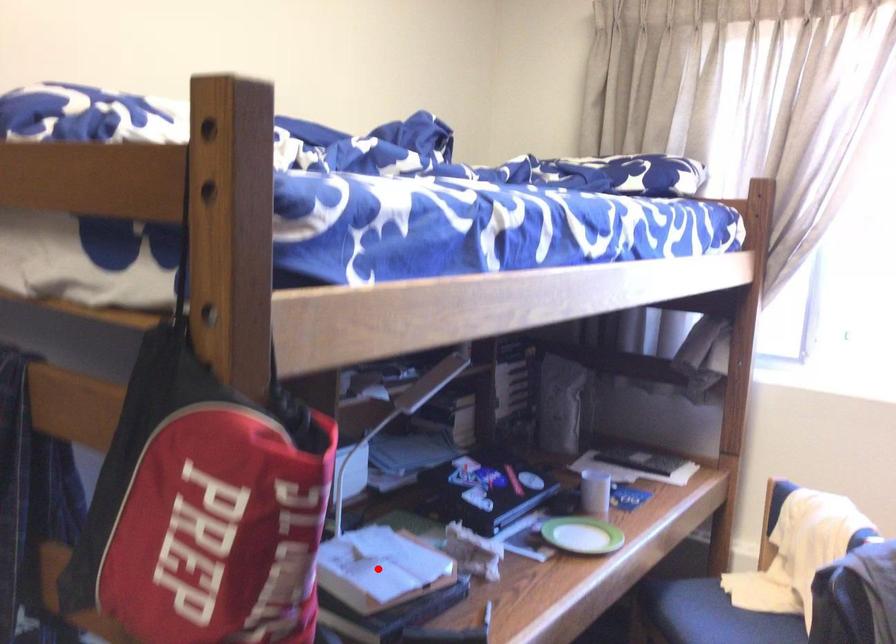
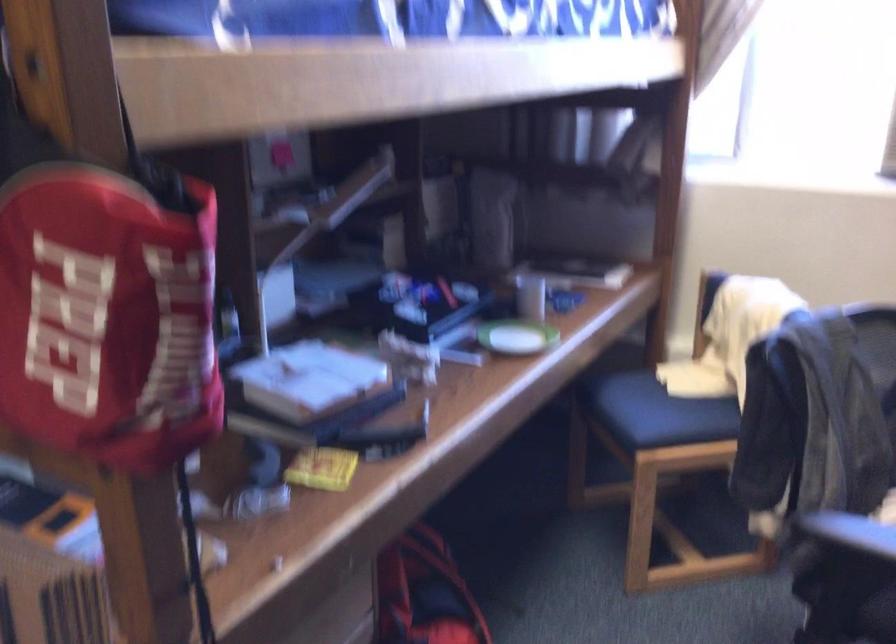
Where in the second image is the point corresponding to the highlighted location from the first image?

(309, 380)